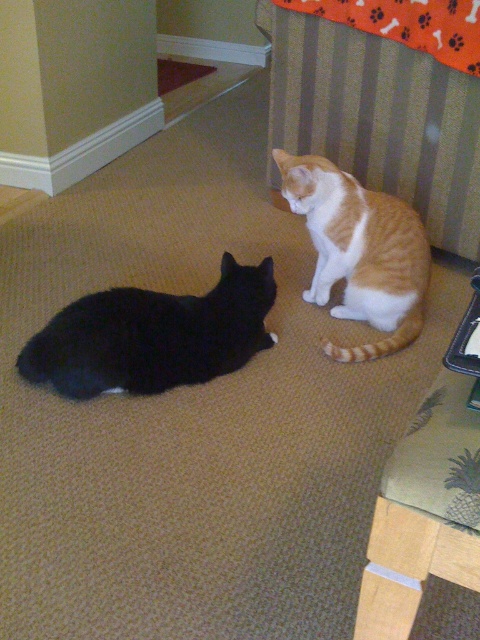
Question: Among these objects, which one is nearest to the camera?

Choices:
 (A) brown carpet at upper left
 (B) black matte fur cat at lower left

Answer: (B)

Question: Is black matte fur cat at lower left wider than brown carpet at upper left?

Choices:
 (A) no
 (B) yes

Answer: (B)

Question: Which point is farther to the camera?

Choices:
 (A) (69, 314)
 (B) (372, 307)
 (C) (188, 74)

Answer: (C)

Question: Does black matte fur cat at lower left have a smaller size compared to brown carpet at upper left?

Choices:
 (A) no
 (B) yes

Answer: (A)

Question: Which point is closer to the camera taking this photo?

Choices:
 (A) (288, 172)
 (B) (96, 374)

Answer: (B)

Question: Does black matte fur cat at lower left appear on the left side of brown carpet at upper left?

Choices:
 (A) no
 (B) yes

Answer: (A)